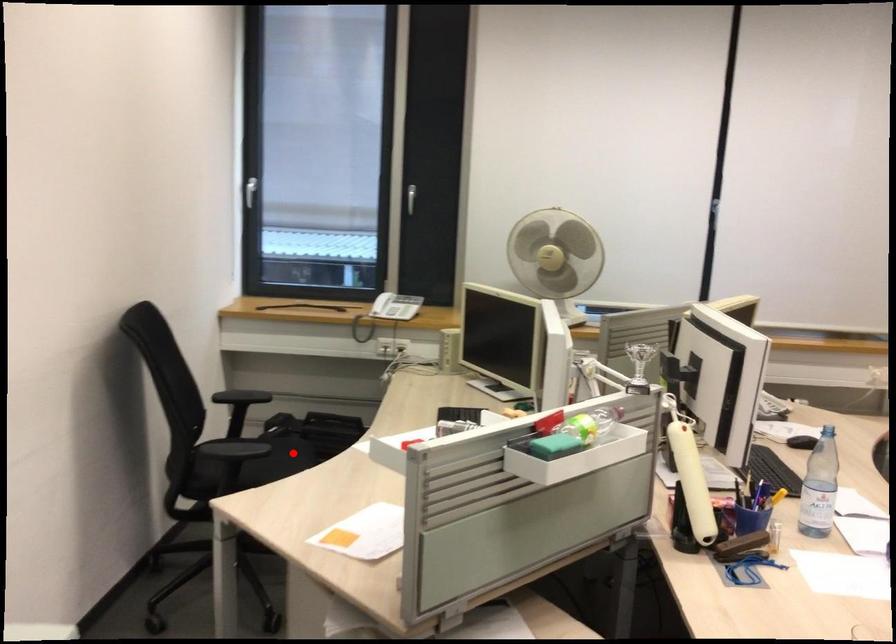
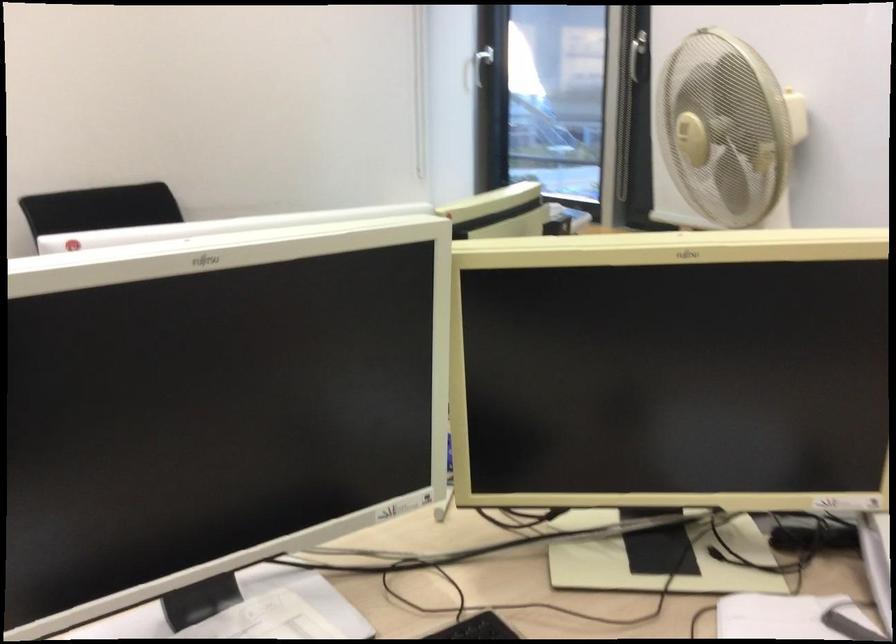
Question: I am providing you with two images of the same scene from different viewpoints. A red point is marked on the first image. Is the red point's position out of view in image 2?

Choices:
 (A) Yes
 (B) No

Answer: (A)